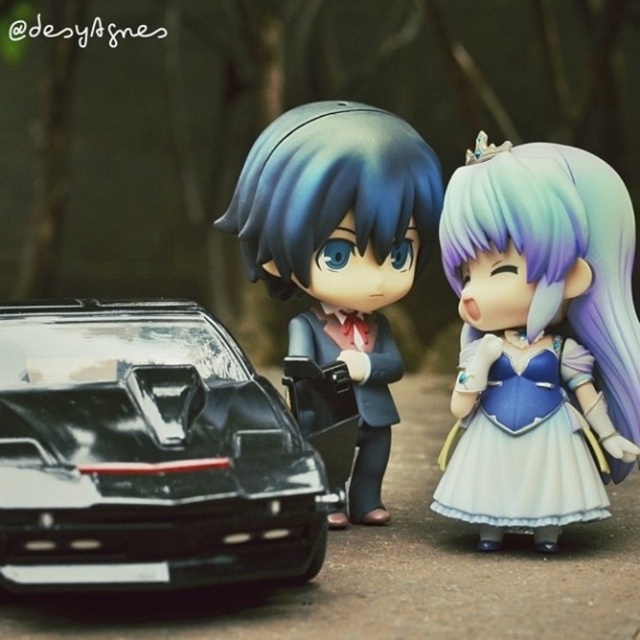
Question: Is satin blue dress at right smaller than satin blue dress at center?

Choices:
 (A) yes
 (B) no

Answer: (A)

Question: Is glossy black car at lower left below satin blue dress at center?

Choices:
 (A) no
 (B) yes

Answer: (B)

Question: Estimate the real-world distances between objects in this image. Which object is farther from the satin blue dress at right?

Choices:
 (A) satin blue dress at center
 (B) glossy black car at lower left

Answer: (B)

Question: Which point is closer to the camera?

Choices:
 (A) [x=554, y=378]
 (B) [x=228, y=547]
 (C) [x=547, y=522]

Answer: (B)

Question: Which is nearer to the glossy black car at lower left?

Choices:
 (A) satin blue dress at right
 (B) satin blue dress at center

Answer: (B)

Question: Is glossy black car at lower left above satin blue dress at center?

Choices:
 (A) yes
 (B) no

Answer: (B)